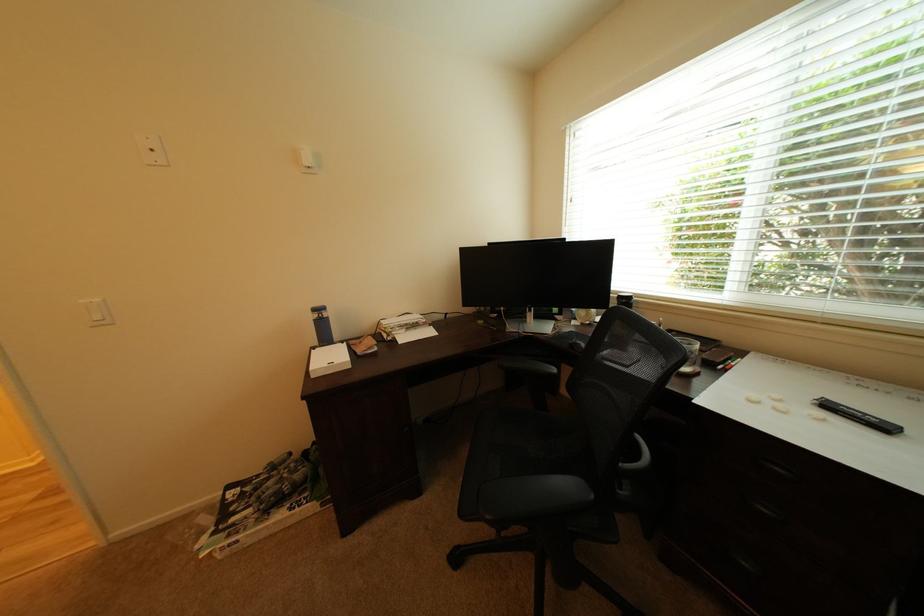
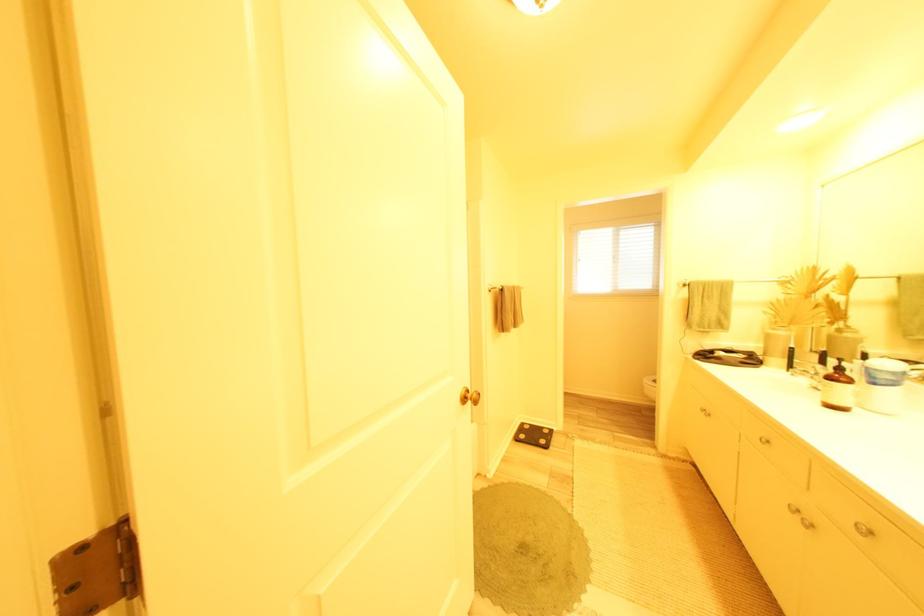
Question: I am providing you with two images of the same scene from different viewpoints. Which of the following objects are not visible in image2?

Choices:
 (A) green bottle pump
 (B) brown bottle pump
 (C) potted plant
 (D) black marker

Answer: (D)